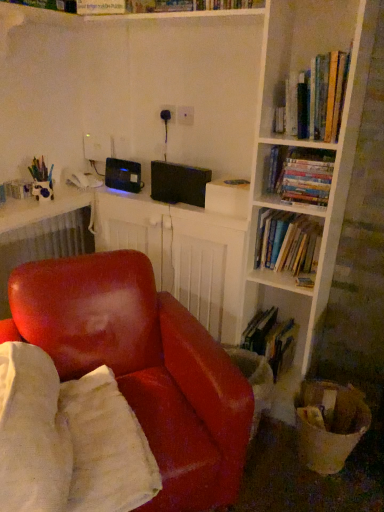
Question: Is leather at center smaller than hardcover book at lower center, arranged as the 4th book when viewed from the top?

Choices:
 (A) no
 (B) yes

Answer: (A)

Question: Is leather at center looking in the opposite direction of hardcover book at lower center, arranged as the 4th book when viewed from the top?

Choices:
 (A) yes
 (B) no

Answer: (B)

Question: Is leather at center touching hardcover book at lower center, which is the first book in bottom-to-top order?

Choices:
 (A) yes
 (B) no

Answer: (B)

Question: From the image's perspective, does leather at center appear higher than hardcover book at lower center, which is the first book in bottom-to-top order?

Choices:
 (A) no
 (B) yes

Answer: (A)

Question: From a real-world perspective, does leather at center stand above hardcover book at lower center, which is the first book in bottom-to-top order?

Choices:
 (A) no
 (B) yes

Answer: (B)

Question: From a real-world perspective, is hardcover books at upper right, acting as the first book starting from the top, physically located above or below white textured radiator at upper left?

Choices:
 (A) above
 (B) below

Answer: (A)

Question: Would you say hardcover books at upper right, acting as the first book starting from the top, is to the left or to the right of white textured radiator at upper left in the picture?

Choices:
 (A) right
 (B) left

Answer: (A)

Question: In terms of width, does hardcover books at upper right, which is counted as the fourth book, starting from the bottom, look wider or thinner when compared to white textured radiator at upper left?

Choices:
 (A) thin
 (B) wide

Answer: (B)

Question: Choose the correct answer: Is hardcover books at upper right, which is counted as the fourth book, starting from the bottom, inside white textured radiator at upper left or outside it?

Choices:
 (A) inside
 (B) outside

Answer: (B)

Question: Would you say hardcover books at upper right, acting as the first book starting from the top, is to the left or to the right of black plastic computer desk at center in the picture?

Choices:
 (A) right
 (B) left

Answer: (A)

Question: Is hardcover books at upper right, which is counted as the fourth book, starting from the bottom, bigger or smaller than black plastic computer desk at center?

Choices:
 (A) small
 (B) big

Answer: (A)

Question: From a real-world perspective, relative to black plastic computer desk at center, is hardcover books at upper right, acting as the first book starting from the top, vertically above or below?

Choices:
 (A) above
 (B) below

Answer: (A)

Question: From the image's perspective, relative to black plastic computer desk at center, is hardcover books at upper right, which is counted as the fourth book, starting from the bottom, above or below?

Choices:
 (A) below
 (B) above

Answer: (B)

Question: In terms of size, does hardcover books at upper right, which is counted as the fourth book, starting from the bottom, appear bigger or smaller than hardcover book at lower center, which is the first book in bottom-to-top order?

Choices:
 (A) big
 (B) small

Answer: (A)

Question: Is hardcover books at upper right, acting as the first book starting from the top, situated inside hardcover book at lower center, which is the first book in bottom-to-top order, or outside?

Choices:
 (A) inside
 (B) outside

Answer: (B)